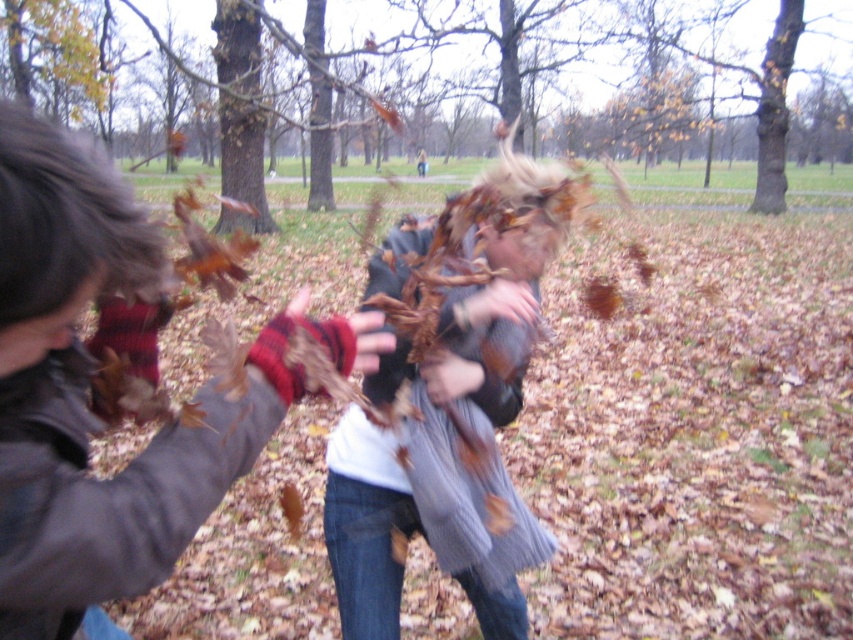
You are a photographer trying to capture a closeup of the plaid wool mittens at left and the gray knitted sweater at center. Which object should you focus on first if you want to ensure both are in the frame without moving the camera?

The plaid wool mittens at left is positioned on the left side of gray knitted sweater at center, so you should focus on the plaid wool mittens at left first to ensure both are in the frame without moving the camera.

You are trying to locate the plaid wool mittens at left and the gray knitted sweater at center in the autumn park scene. Based on their positions, which object is closer to you as an observer?

The plaid wool mittens at left are closer to you since they are positioned in front of the gray knitted sweater at center.